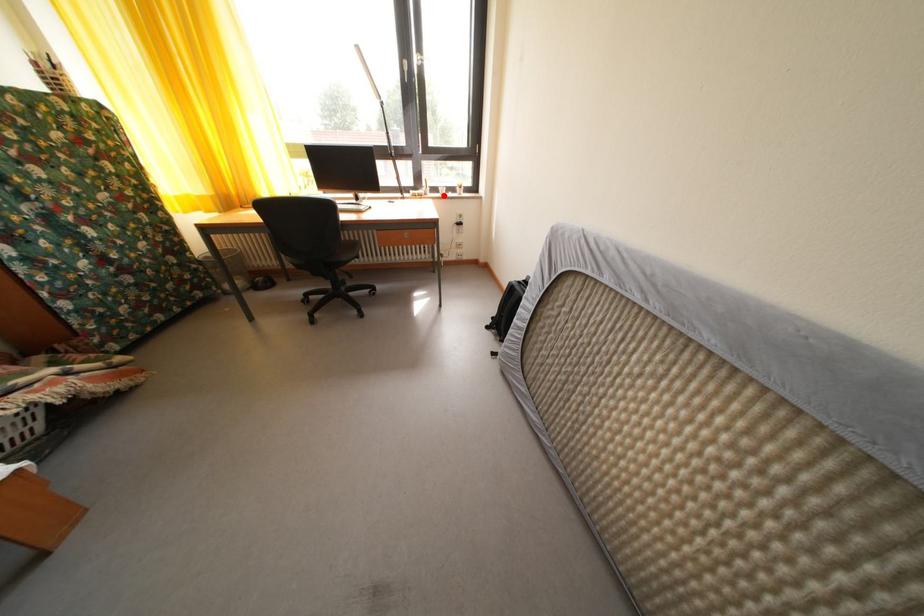
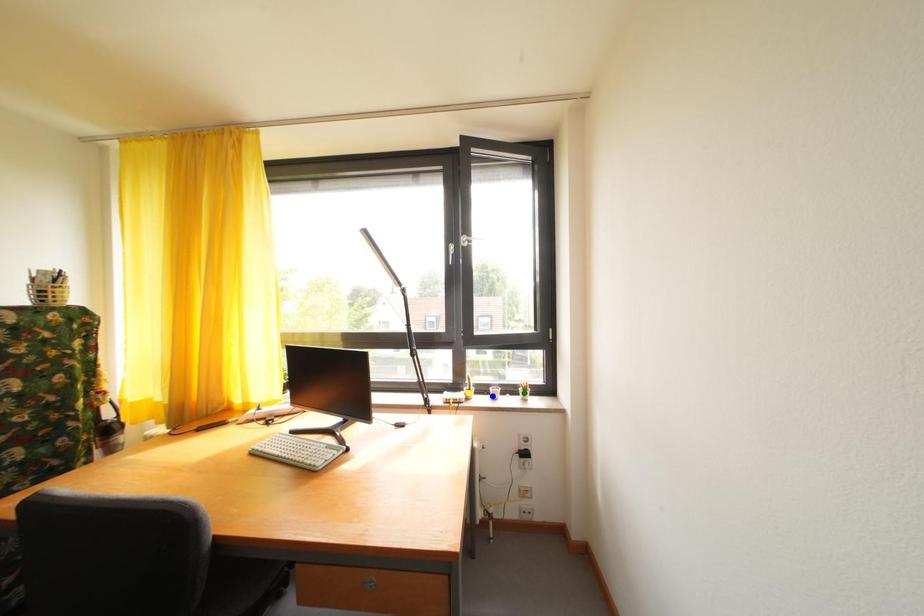
Question: I am providing you with two images of the same scene from different viewpoints. A red point is marked on the first image. You are given multiple points on the second image. Can you choose the point in image 2 that corresponds to the point in image 1?

Choices:
 (A) yellow point
 (B) blue point
 (C) green point

Answer: (B)